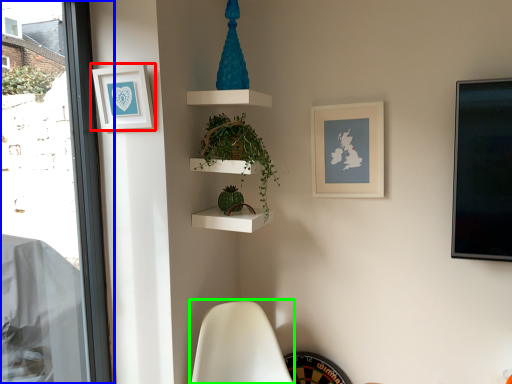
Question: Which object is the closest to the picture frame (highlighted by a red box)? Choose among these: window (highlighted by a blue box) or swivel chair (highlighted by a green box).

Choices:
 (A) window
 (B) swivel chair

Answer: (A)